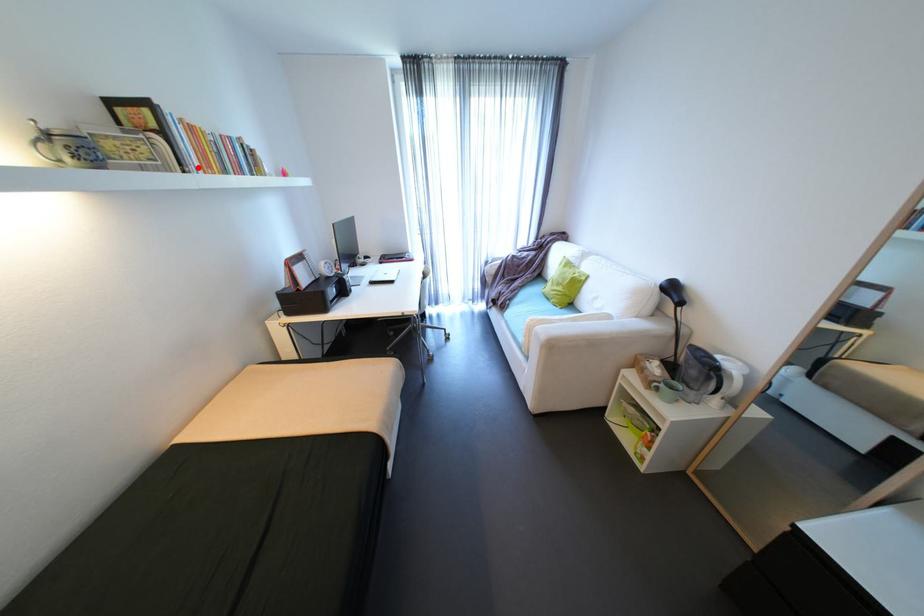
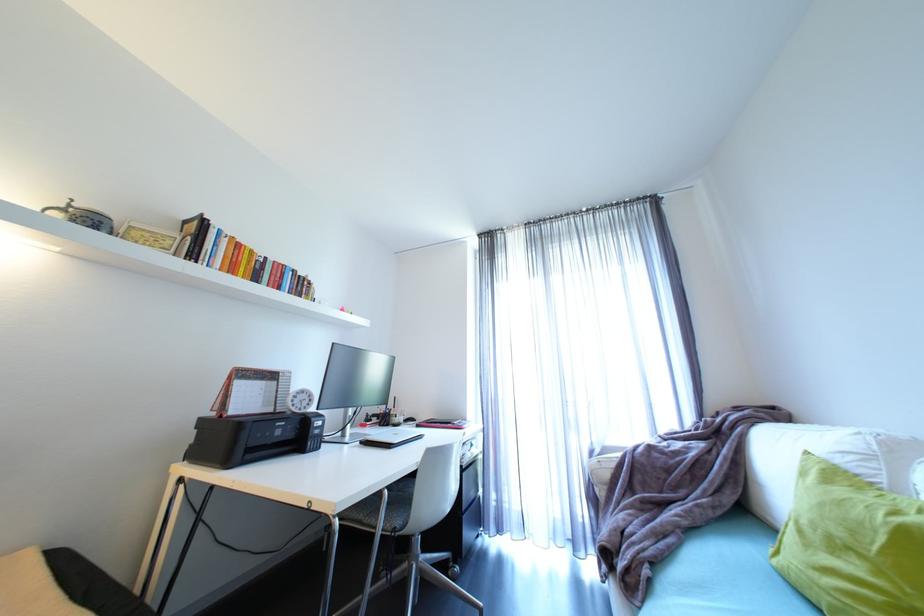
Where in the second image is the point corresponding to the highlighted location from the first image?

(208, 262)